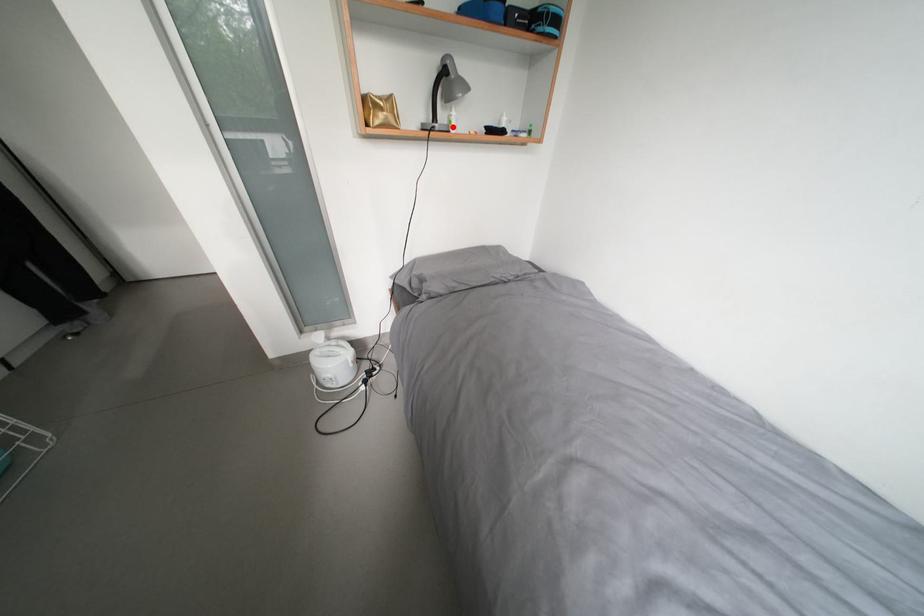
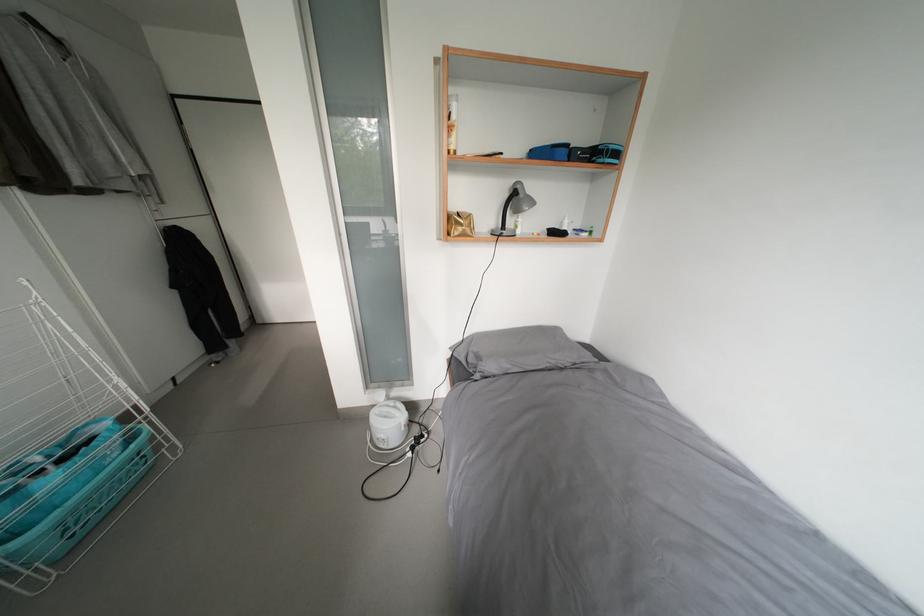
Find the pixel in the second image that matches the highlighted location in the first image.

(519, 232)